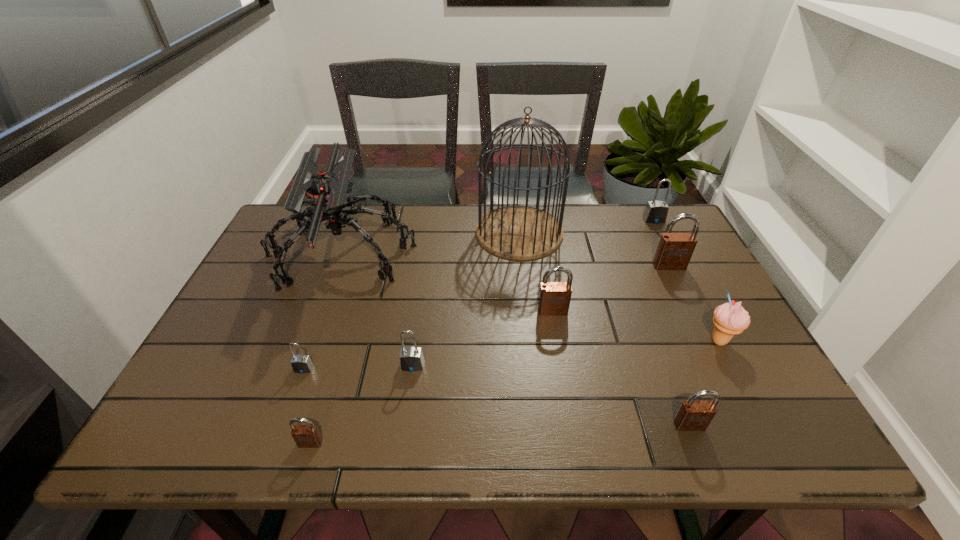
I want to click on vacant space located 0.250m at the door of the gray birdcage, so click(x=396, y=232).

Identify the location of vacant space located 0.140m at the door of the gray birdcage. (431, 232).

You are a GUI agent. You are given a task and a screenshot of the screen. Output one action in this format:
    pyautogui.click(x=<x>, y=<y>)
    Task: Click on the free spot located on the front of the ninth shortest object
    
    Given the screenshot: What is the action you would take?
    pyautogui.click(x=271, y=444)

Where is `vacant region located 0.120m on the front-facing side of the sixth nearest padlock`? This screenshot has height=540, width=960. vacant region located 0.120m on the front-facing side of the sixth nearest padlock is located at coordinates (685, 300).

Find the location of a particular element. vacant space located 0.050m on the shackle of the farthest gray padlock is located at coordinates (660, 233).

I want to click on free space located 0.340m on the front-facing side of the third nearest brown padlock, so click(575, 442).

The image size is (960, 540). In order to click on vacant region located on the left of the icecream in this screenshot , I will do `click(562, 341)`.

At what (x,y) coordinates should I click in order to perform the action: click on vacant space located 0.120m on the shackle of the third padlock from left to right. Please return your answer as a coordinate pair (x, y). Image resolution: width=960 pixels, height=540 pixels. Looking at the image, I should click on point(405,420).

The height and width of the screenshot is (540, 960). What are the coordinates of `free space located 0.050m on the shackle of the leftmost gray padlock` in the screenshot? It's located at (296, 393).

The height and width of the screenshot is (540, 960). Identify the location of birdcage at the far edge. (519, 232).